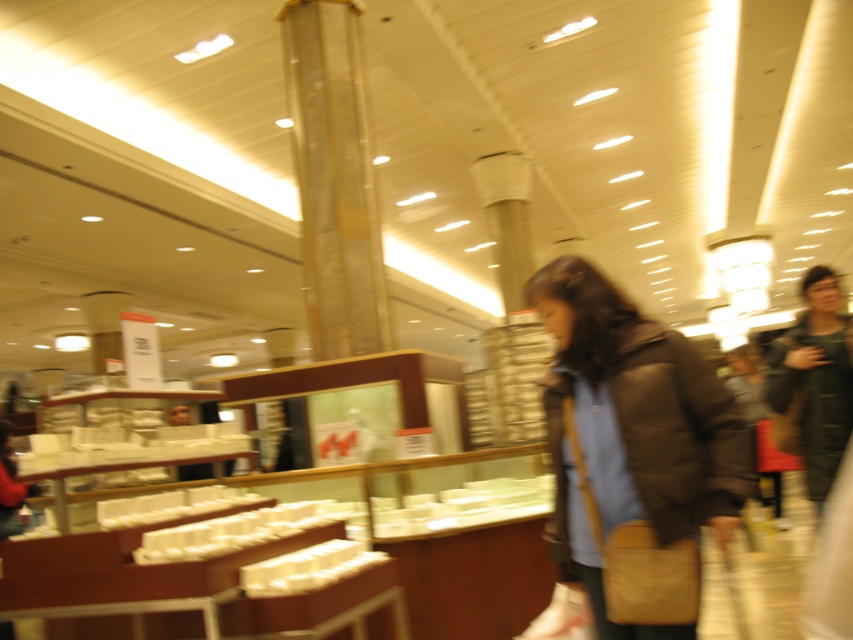
Is matte black jacket at center wider than dark brown leather jacket at right?

Yes.

Does matte black jacket at center have a larger size compared to dark brown leather jacket at right?

A: No, matte black jacket at center is not bigger than dark brown leather jacket at right.

You are a GUI agent. You are given a task and a screenshot of the screen. Output one action in this format:
    pyautogui.click(x=<x>, y=<y>)
    Task: Click on the matte black jacket at center
    The height and width of the screenshot is (640, 853).
    Given the screenshot: What is the action you would take?
    pyautogui.click(x=646, y=444)